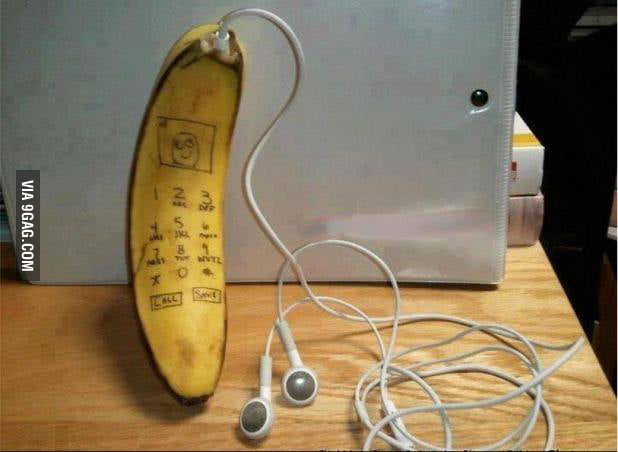
The height and width of the screenshot is (452, 618). Find the location of `white binder`. white binder is located at coordinates (429, 41).